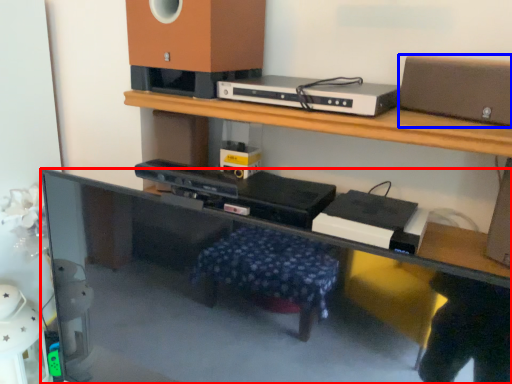
Question: Which object is further to the camera taking this photo, computer desk (highlighted by a red box) or speaker (highlighted by a blue box)?

Choices:
 (A) computer desk
 (B) speaker

Answer: (B)